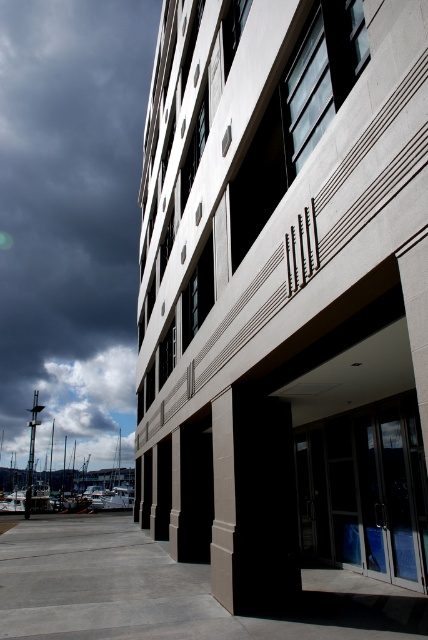
You are standing at the entrance of the modern building and looking up at the white fluffy cloud at upper left. If you have a camera with a 50mm lens, can you capture the entire cloud in one photo without moving your position?

The white fluffy cloud at upper left is 158.63 meters away from the viewer. A 50mm lens has a standard field of view, so capturing the entire cloud at that distance would likely be possible without needing to move your position.

You are standing at the entrance of the modern building and looking up. There is a point marked at coordinates (71, 220). What object or feature is located at that point?

The point at coordinates (71, 220) is occupied by the dark cloudy sky at upper left.

You are standing in front of the modern building and notice the dark cloudy sky at upper left and the white glossy boats at lower left. Which of these two elements has a greater width in the image?

The dark cloudy sky at upper left has a greater width than the white glossy boats at lower left.